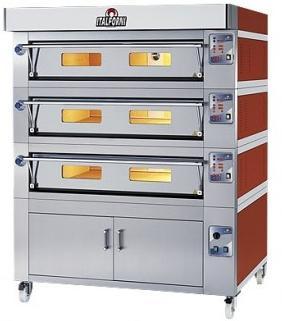
Find the location of a particular element. handles is located at coordinates (119, 240), (105, 237), (162, 161), (169, 44), (169, 102).